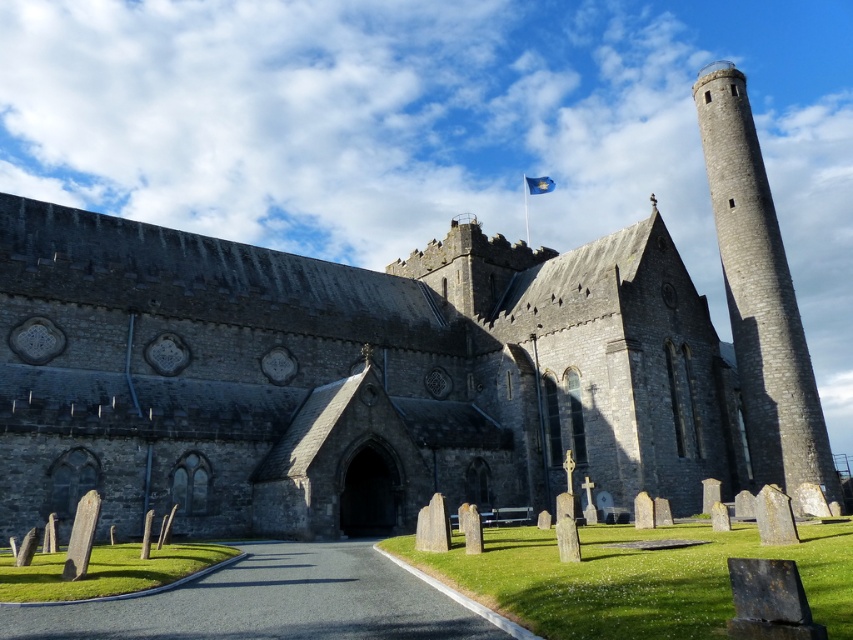
You are a photographer planning to capture the historic stone church from a distance. You want to ensure both the gray stone tower at right and the blue fabric flag at upper center are visible in your shot. Given their relative heights, which object will appear taller in the photograph?

The gray stone tower at right appears taller in the photograph because it has a greater height compared to the blue fabric flag at upper center.

You are standing in front of the historic stone church and want to find the smooth gray stone tombstone at lower left. Which direction should you turn to face the gray stone tower at right?

To face the gray stone tower at right, you should turn to your right from the smooth gray stone tombstone at lower left since the tower is positioned on the right side of the tombstone.